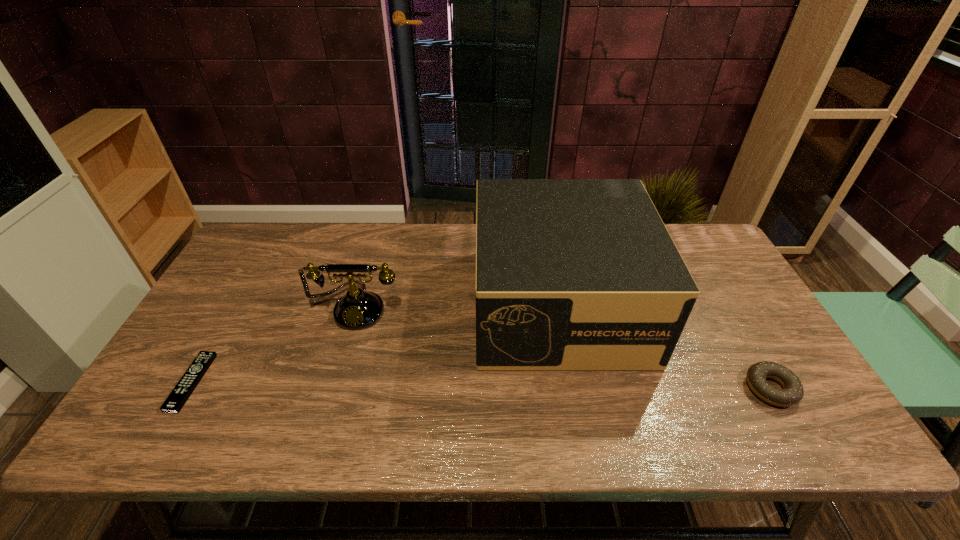
Identify the location of free location located 0.300m on the back of the rightmost object. The height and width of the screenshot is (540, 960). (712, 286).

This screenshot has width=960, height=540. I want to click on vacant space located 0.320m on the back of the leftmost object, so click(254, 272).

I want to click on object that is positioned at the far edge, so click(x=571, y=274).

This screenshot has width=960, height=540. I want to click on doughnut located at the near edge, so click(792, 392).

Find the location of a particular element. This screenshot has width=960, height=540. remote control present at the near edge is located at coordinates [182, 391].

At what (x,y) coordinates should I click in order to perform the action: click on object at the left edge. Please return your answer as a coordinate pair (x, y). Looking at the image, I should click on (182, 391).

Where is `object present at the right edge`? The image size is (960, 540). object present at the right edge is located at coordinates (792, 392).

The image size is (960, 540). In order to click on object that is at the near left corner in this screenshot , I will do `click(182, 391)`.

Image resolution: width=960 pixels, height=540 pixels. I want to click on object that is at the near right corner, so click(x=792, y=392).

The image size is (960, 540). In order to click on free space at the far edge in this screenshot , I will do `click(453, 242)`.